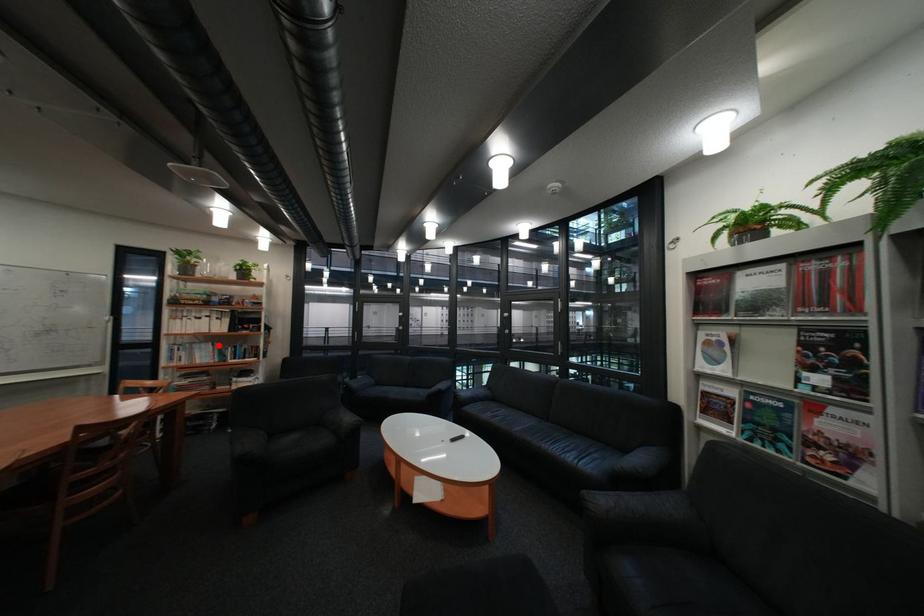
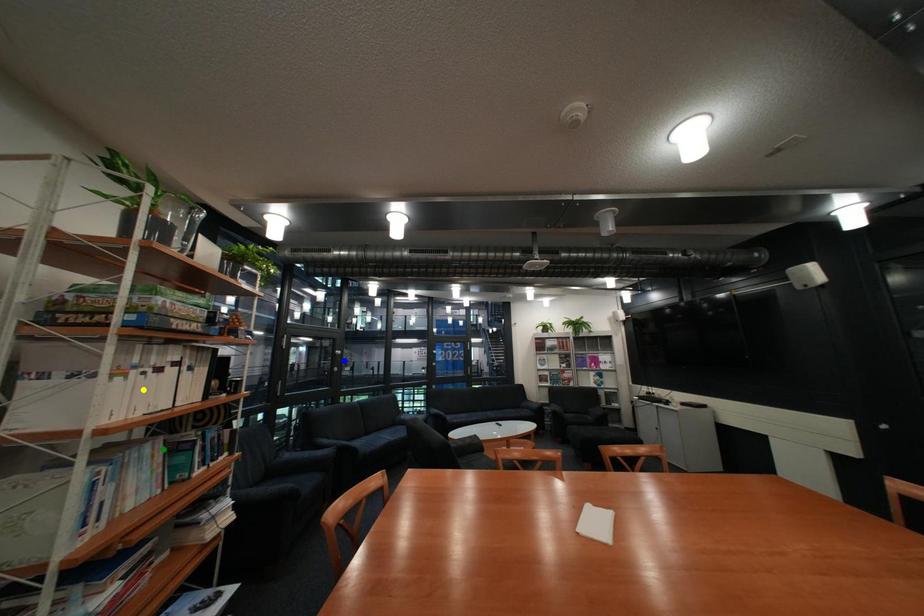
Question: I am providing you with two images of the same scene from different viewpoints. A red point is marked on the first image. You are given multiple points on the second image. Which point in image 2 represents the same 3d spot as the red point in image 1?

Choices:
 (A) green point
 (B) yellow point
 (C) blue point

Answer: (A)